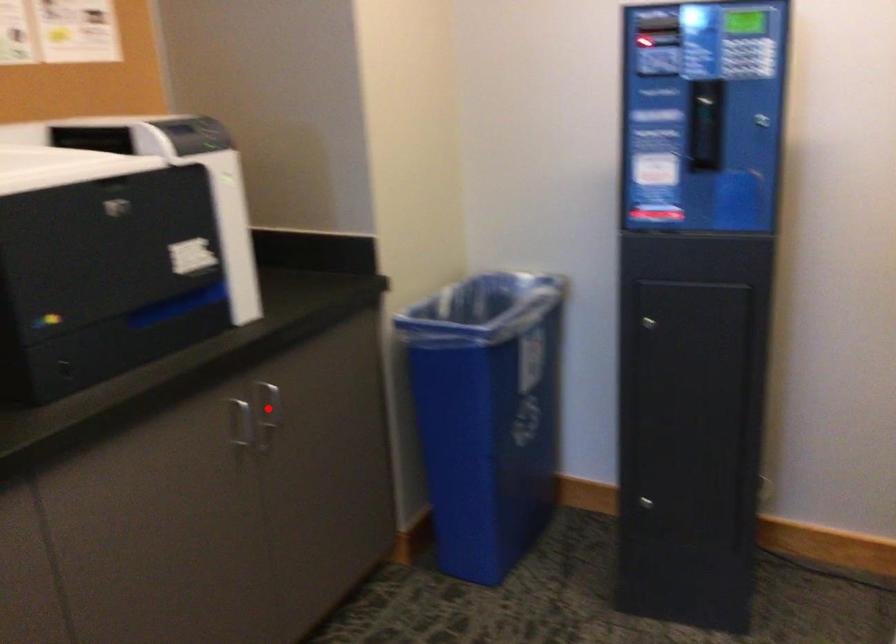
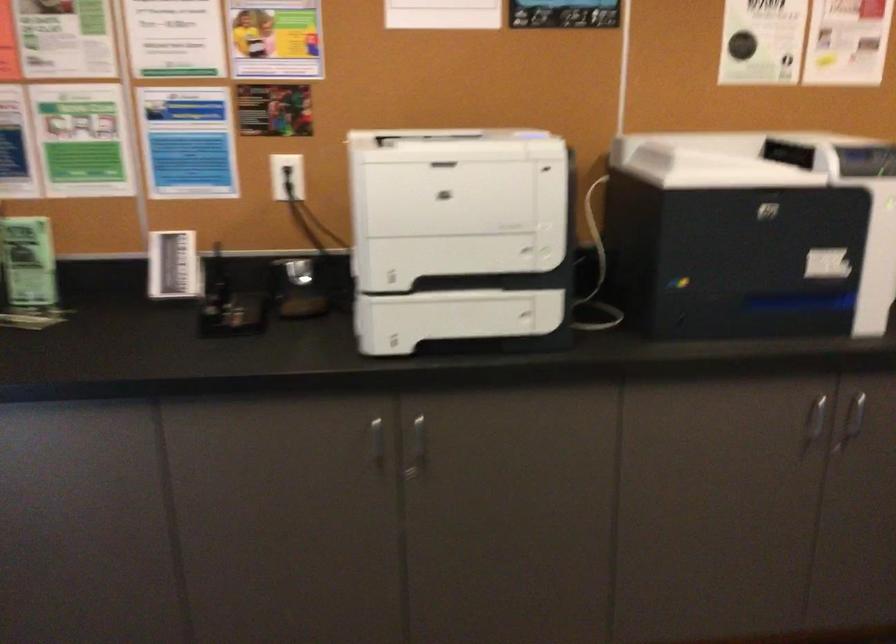
Where in the second image is the point corresponding to the highlighted location from the first image?

(853, 418)